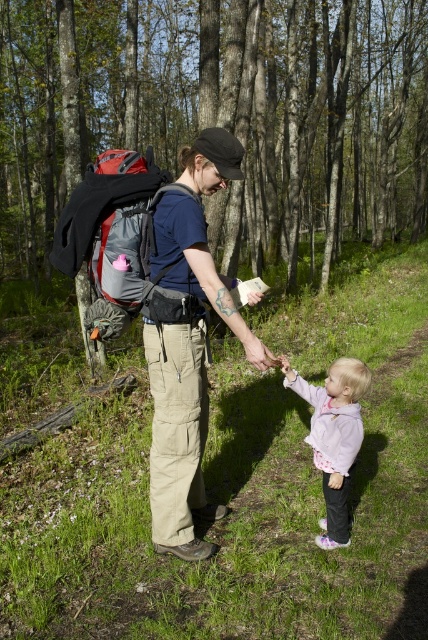
You are a hiker who wants to know which item is shorter between the matte gray backpack at center and the pink fleece jacket at lower right. Which one is shorter?

The matte gray backpack at center is shorter than the pink fleece jacket at lower right.

You are standing in a forest and want to take a photo of the green leafy trees at center. If your camera can focus on objects up to 8 meters away, will you need to move closer or further away to get a clear shot?

The green leafy trees at center is 8.11 meters away from viewer. Since the camera can focus up to 8 meters, you need to move slightly closer to ensure the trees are within the camera range.